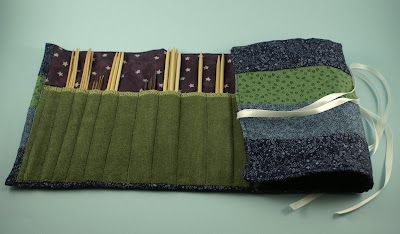
The width and height of the screenshot is (400, 234). I want to click on dark blue patterned fabric, so click(x=308, y=52), click(x=315, y=151), click(x=44, y=61), click(x=46, y=184).